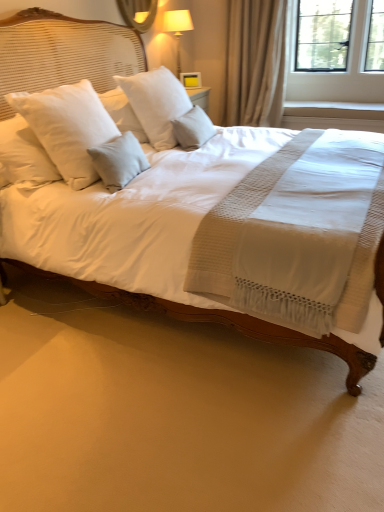
Question: Considering the relative sizes of light gray fabric pillow at center, the 1th pillow viewed from the right, and white soft pillow at upper left, arranged as the 3th pillow when viewed from the right, in the image provided, is light gray fabric pillow at center, the 1th pillow viewed from the right, wider than white soft pillow at upper left, arranged as the 3th pillow when viewed from the right,?

Choices:
 (A) yes
 (B) no

Answer: (B)

Question: Is light gray fabric pillow at center, the 3th pillow in the left-to-right sequence, at the left side of white soft pillow at upper left, the 1th pillow positioned from the left?

Choices:
 (A) no
 (B) yes

Answer: (A)

Question: From the image's perspective, is light gray fabric pillow at center, the 1th pillow viewed from the right, beneath white soft pillow at upper left, the 1th pillow positioned from the left?

Choices:
 (A) yes
 (B) no

Answer: (B)

Question: Considering the relative sizes of light gray fabric pillow at center, the 3th pillow in the left-to-right sequence, and white soft pillow at upper left, the 1th pillow positioned from the left, in the image provided, is light gray fabric pillow at center, the 3th pillow in the left-to-right sequence, thinner than white soft pillow at upper left, the 1th pillow positioned from the left,?

Choices:
 (A) no
 (B) yes

Answer: (B)

Question: Does light gray fabric pillow at center, the 1th pillow viewed from the right, lie behind white soft pillow at upper left, the 1th pillow positioned from the left?

Choices:
 (A) yes
 (B) no

Answer: (A)

Question: Considering the positions of beige fabric curtain at upper right and white wood at upper right in the image, is beige fabric curtain at upper right taller or shorter than white wood at upper right?

Choices:
 (A) short
 (B) tall

Answer: (B)

Question: From a real-world perspective, is beige fabric curtain at upper right physically located above or below white wood at upper right?

Choices:
 (A) below
 (B) above

Answer: (B)

Question: Would you say beige fabric curtain at upper right is inside or outside white wood at upper right?

Choices:
 (A) inside
 (B) outside

Answer: (B)

Question: In terms of size, does beige fabric curtain at upper right appear bigger or smaller than white wood at upper right?

Choices:
 (A) big
 (B) small

Answer: (A)

Question: Looking at the image, does glossy glass mirror at upper center seem bigger or smaller compared to white soft pillow at center, marked as the second pillow in a right-to-left arrangement?

Choices:
 (A) small
 (B) big

Answer: (A)

Question: Relative to white soft pillow at center, which is the 2th pillow from left to right, is glossy glass mirror at upper center in front or behind?

Choices:
 (A) behind
 (B) front

Answer: (A)

Question: In terms of height, does glossy glass mirror at upper center look taller or shorter compared to white soft pillow at center, marked as the second pillow in a right-to-left arrangement?

Choices:
 (A) short
 (B) tall

Answer: (A)

Question: Is glossy glass mirror at upper center inside the boundaries of white soft pillow at center, marked as the second pillow in a right-to-left arrangement, or outside?

Choices:
 (A) outside
 (B) inside

Answer: (A)

Question: Based on their positions, is light gray fabric pillow at center, the 1th pillow viewed from the right, located to the left or right of white soft pillow at center, marked as the second pillow in a right-to-left arrangement?

Choices:
 (A) right
 (B) left

Answer: (A)

Question: From their relative heights in the image, would you say light gray fabric pillow at center, the 3th pillow in the left-to-right sequence, is taller or shorter than white soft pillow at center, marked as the second pillow in a right-to-left arrangement?

Choices:
 (A) short
 (B) tall

Answer: (A)